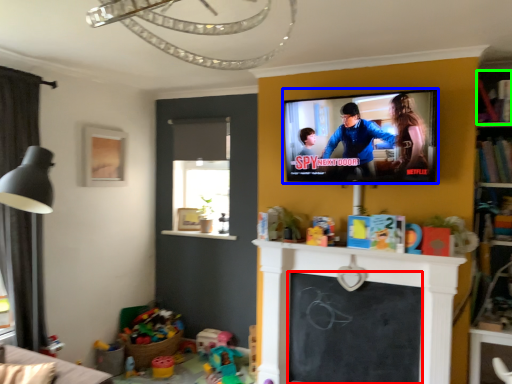
Question: Considering the real-world distances, which object is farthest from screen (highlighted by a red box)? television (highlighted by a blue box) or shelf (highlighted by a green box)?

Choices:
 (A) television
 (B) shelf

Answer: (B)